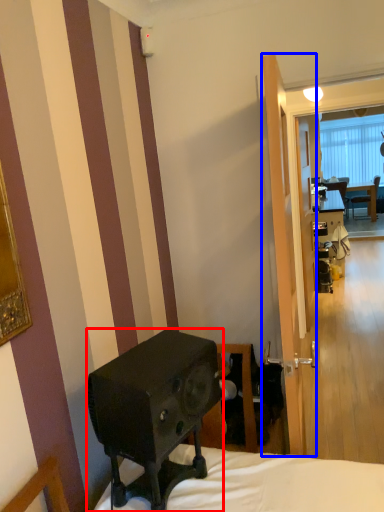
Question: Among these objects, which one is nearest to the camera, loudspeaker (highlighted by a red box) or screen door (highlighted by a blue box)?

Choices:
 (A) loudspeaker
 (B) screen door

Answer: (A)